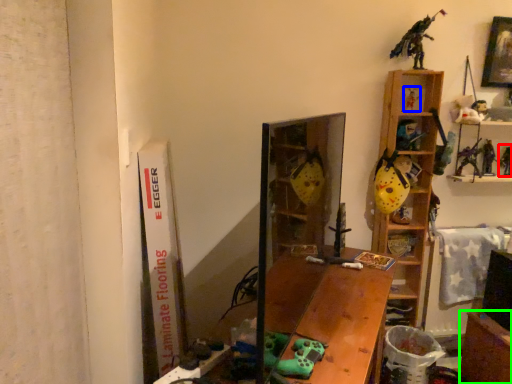
Question: Which object is the closest to the toy (highlighted by a red box)? Choose among these: toy (highlighted by a blue box) or table (highlighted by a green box).

Choices:
 (A) toy
 (B) table

Answer: (A)